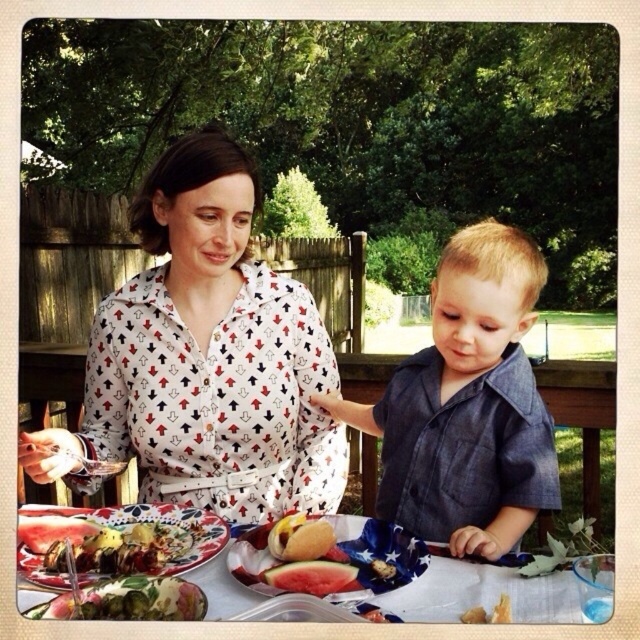
In the scene shown: You are standing in the backyard and want to place a new plate on the white fabric table at center. Based on the coordinates provided, where exactly should you place the plate?

The white fabric table at center is located at coordinates point (582, 420), so you should place the plate at that position.